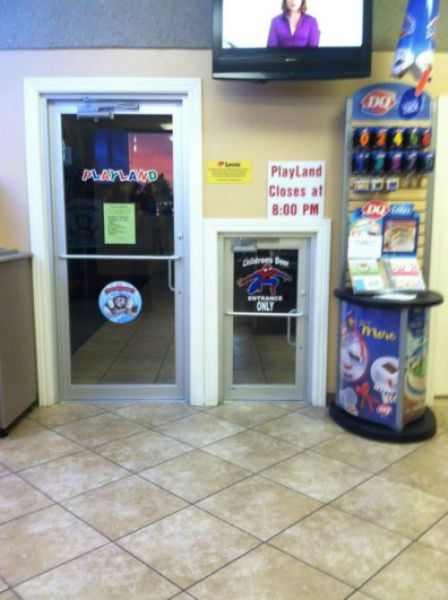
At what (x,y) coordinates should I click in order to perform the action: click on floor. Please return your answer as a coordinate pair (x, y). This screenshot has width=448, height=600. Looking at the image, I should click on (121, 496), (142, 346), (270, 356).